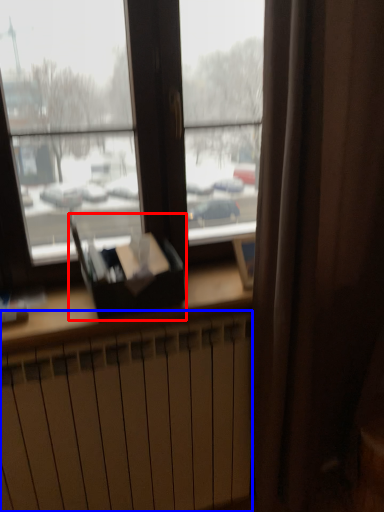
Question: Which of the following is the closest to the observer, paperback book (highlighted by a red box) or radiator (highlighted by a blue box)?

Choices:
 (A) paperback book
 (B) radiator

Answer: (B)